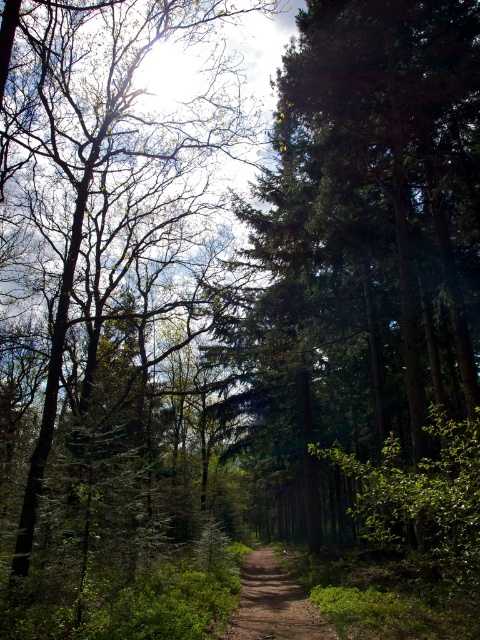
You are a hiker standing on the dirt trail in the forest scene. You notice two trees at the center of the image, the green leafy tree at center and the green textured tree at center. Which one is more to the left?

The green leafy tree at center is positioned on the left side of green textured tree at center, so it is more to the left.